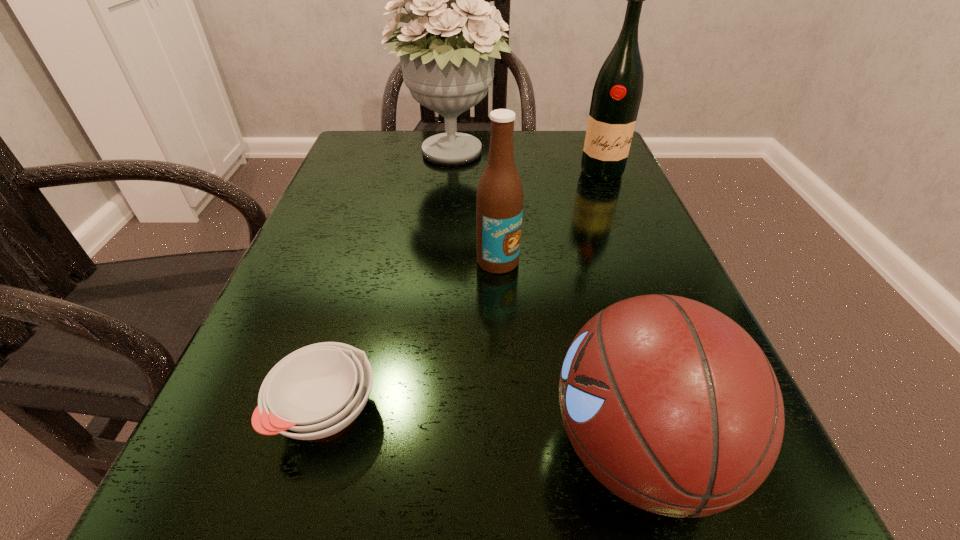
At what (x,y) coordinates should I click in order to perform the action: click on vacant position at the far left corner of the desktop. Please return your answer as a coordinate pair (x, y). The image size is (960, 540). Looking at the image, I should click on (403, 134).

The image size is (960, 540). Find the location of `vacant area at the far right corner of the desktop`. vacant area at the far right corner of the desktop is located at coordinates (569, 166).

You are a GUI agent. You are given a task and a screenshot of the screen. Output one action in this format:
    pyautogui.click(x=<x>, y=<y>)
    Task: Click on the free space between the beer bottle and the soup bowl
    
    Given the screenshot: What is the action you would take?
    pyautogui.click(x=413, y=336)

This screenshot has width=960, height=540. I want to click on free space between the bouquet and the soup bowl, so click(390, 282).

At what (x,y) coordinates should I click in order to perform the action: click on free space that is in between the liquor and the third nearest object. Please return your answer as a coordinate pair (x, y). Looking at the image, I should click on (550, 217).

Where is `free spot between the liquor and the bouquet`? The image size is (960, 540). free spot between the liquor and the bouquet is located at coordinates (527, 163).

You are a GUI agent. You are given a task and a screenshot of the screen. Output one action in this format:
    pyautogui.click(x=<x>, y=<y>)
    Task: Click on the fourth closest object to the liquor
    The width and height of the screenshot is (960, 540).
    Given the screenshot: What is the action you would take?
    pyautogui.click(x=316, y=391)

The image size is (960, 540). I want to click on object that is the fourth closest to the third nearest object, so click(617, 93).